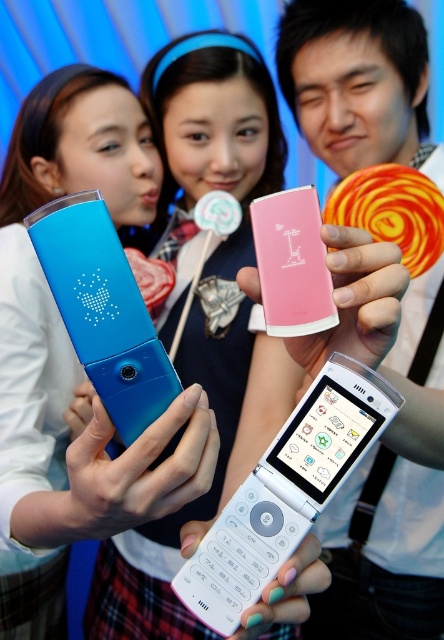
Between point (246, 513) and point (94, 250), which one is positioned behind?

Positioned behind is point (246, 513).

Between point (232, 554) and point (122, 436), which one is positioned in front?

Point (122, 436)

At what (x,y) coordinates should I click in order to perform the action: click on white plastic flip phone at center. Please return your answer as a coordinate pair (x, y). This screenshot has width=444, height=640. Looking at the image, I should click on (285, 492).

Is blue glossy phone at left above white plastic flip phone at center?

Indeed, blue glossy phone at left is positioned over white plastic flip phone at center.

Describe the element at coordinates (74, 355) in the screenshot. This screenshot has height=640, width=444. I see `blue glossy phone at left` at that location.

Where is `blue glossy phone at left`? The image size is (444, 640). blue glossy phone at left is located at coordinates (74, 355).

Is blue glossy phone at left wider than blue glossy ipod at center?

Correct, the width of blue glossy phone at left exceeds that of blue glossy ipod at center.

Find the location of a particular element. blue glossy phone at left is located at coordinates (74, 355).